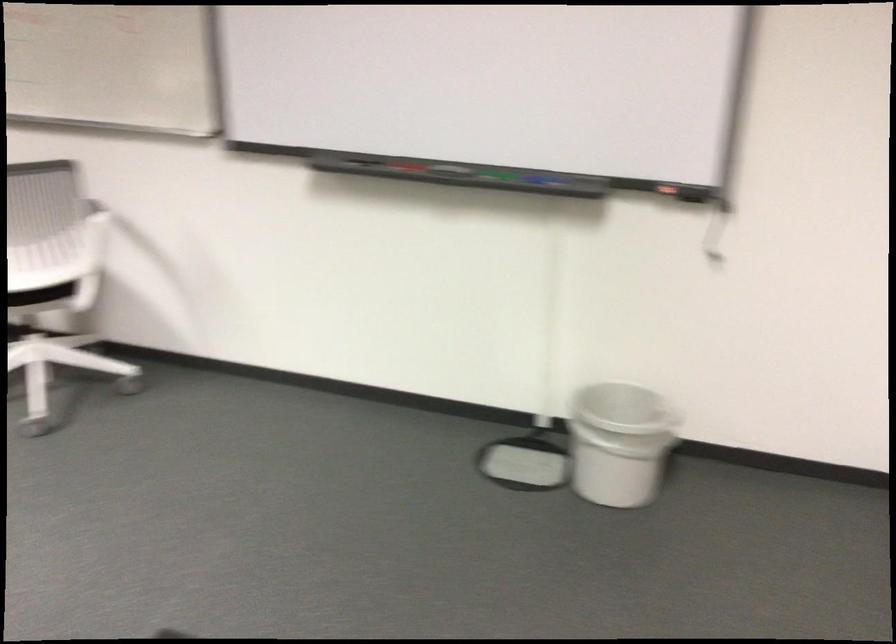
Locate an element on the screen. Image resolution: width=896 pixels, height=644 pixels. chair sitting surface is located at coordinates (40, 295).